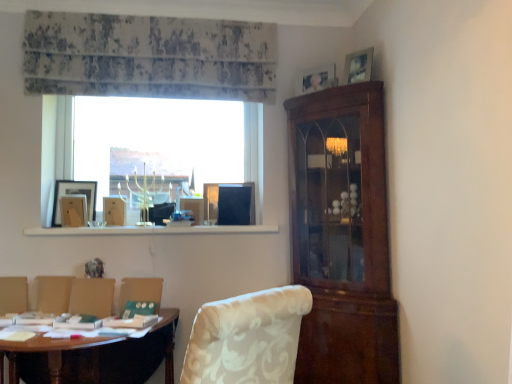
Question: Can you confirm if white floral fabric armchair at lower center, positioned as the 4th armchair in left-to-right order, is bigger than clear glass window at center?

Choices:
 (A) no
 (B) yes

Answer: (A)

Question: Is there a large distance between white floral fabric armchair at lower center, arranged as the first armchair when viewed from the right, and clear glass window at center?

Choices:
 (A) yes
 (B) no

Answer: (B)

Question: From a real-world perspective, does white floral fabric armchair at lower center, arranged as the first armchair when viewed from the right, sit lower than clear glass window at center?

Choices:
 (A) yes
 (B) no

Answer: (A)

Question: Would you say white floral fabric armchair at lower center, arranged as the first armchair when viewed from the right, is outside clear glass window at center?

Choices:
 (A) no
 (B) yes

Answer: (B)

Question: Can you confirm if white floral fabric armchair at lower center, arranged as the first armchair when viewed from the right, is taller than clear glass window at center?

Choices:
 (A) no
 (B) yes

Answer: (A)

Question: Considering the relative sizes of white floral fabric armchair at lower center, positioned as the 4th armchair in left-to-right order, and clear glass window at center in the image provided, is white floral fabric armchair at lower center, positioned as the 4th armchair in left-to-right order, wider than clear glass window at center?

Choices:
 (A) yes
 (B) no

Answer: (B)

Question: Does white floral fabric armchair at lower center, the second armchair from the right, have a greater height compared to clear glass window at center?

Choices:
 (A) no
 (B) yes

Answer: (A)

Question: Is white floral fabric armchair at lower center, arranged as the third armchair when viewed from the left, outside of clear glass window at center?

Choices:
 (A) no
 (B) yes

Answer: (B)

Question: From a real-world perspective, is white floral fabric armchair at lower center, arranged as the third armchair when viewed from the left, below clear glass window at center?

Choices:
 (A) yes
 (B) no

Answer: (A)

Question: Could you tell me if white floral fabric armchair at lower center, the second armchair from the right, is facing clear glass window at center?

Choices:
 (A) no
 (B) yes

Answer: (A)

Question: Does white floral fabric armchair at lower center, arranged as the third armchair when viewed from the left, have a lesser width compared to clear glass window at center?

Choices:
 (A) no
 (B) yes

Answer: (B)

Question: Considering the relative sizes of white floral fabric armchair at lower center, arranged as the third armchair when viewed from the left, and clear glass window at center in the image provided, is white floral fabric armchair at lower center, arranged as the third armchair when viewed from the left, smaller than clear glass window at center?

Choices:
 (A) no
 (B) yes

Answer: (B)

Question: Does wooden picture frame at left, which appears as the 3th picture frame when viewed from the top, contain wooden picture frame at upper right, which is the fourth picture frame in left-to-right order?

Choices:
 (A) yes
 (B) no

Answer: (B)